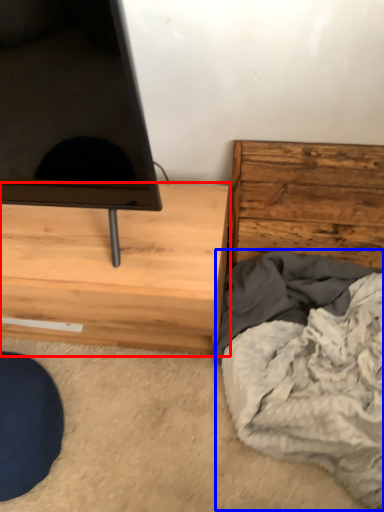
Question: Which of the following is the farthest to the observer, chest of drawers (highlighted by a red box) or blanket (highlighted by a blue box)?

Choices:
 (A) chest of drawers
 (B) blanket

Answer: (A)